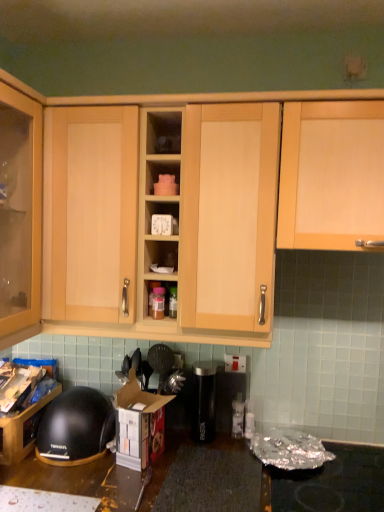
At what (x,y) coordinates should I click in order to perform the action: click on free region under light wood cabinet door at upper right, the 3th cabinetry from the left (from a real-world perspective). Please return your answer as a coordinate pair (x, y). This screenshot has width=384, height=512. Looking at the image, I should click on (342, 457).